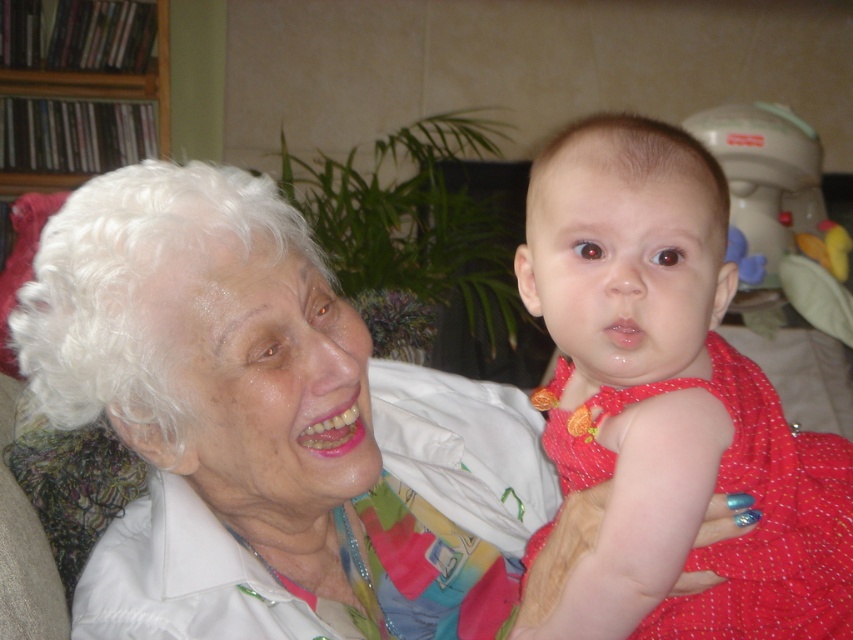
Question: Which point is closer to the camera taking this photo?

Choices:
 (A) (633, 164)
 (B) (508, 400)

Answer: (A)

Question: Which of the following is the farthest from the observer?

Choices:
 (A) (289, 458)
 (B) (780, 461)

Answer: (B)

Question: Among these objects, which one is farthest from the camera?

Choices:
 (A) white matte hair at upper left
 (B) matte red dress at center

Answer: (A)

Question: Is white matte hair at upper left positioned at the back of matte red dress at center?

Choices:
 (A) no
 (B) yes

Answer: (B)

Question: Where is white matte hair at upper left located in relation to matte red dress at center in the image?

Choices:
 (A) below
 (B) above

Answer: (A)

Question: Does white matte hair at upper left have a greater width compared to matte red dress at center?

Choices:
 (A) yes
 (B) no

Answer: (A)